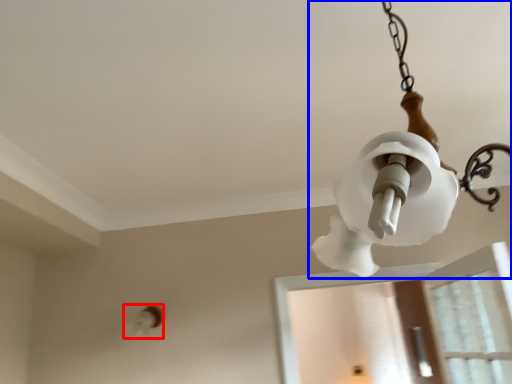
Question: Which object appears closest to the camera in this image, light fixture (highlighted by a red box) or lamp (highlighted by a blue box)?

Choices:
 (A) light fixture
 (B) lamp

Answer: (B)